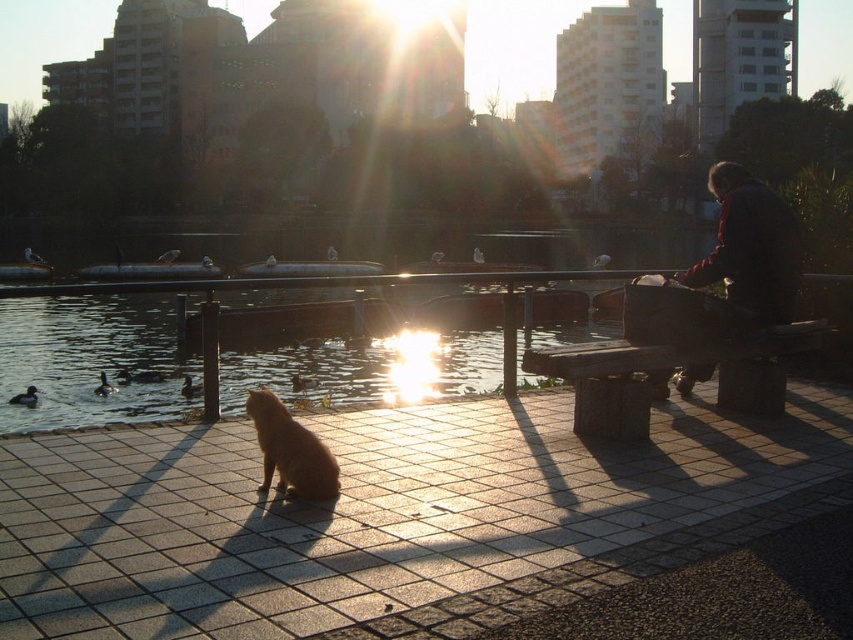
Consider the image. You are a person who is 1.8 meters tall. You want to walk from the smooth stone dock at center to the wooden bench at right. Can you walk straight without bending down? Explain your reasoning.

The smooth stone dock at center and wooden bench at right are 2.29 meters apart. Since the distance between them is greater than your height of 1.8 meters, you can walk straight without bending down as there is enough space.

You are a photographer wanting to capture the golden fur cat at center and the clear water at bench right in the same frame. Based on their positions, can you determine which object is higher in the image?

The clear water at bench right is located above the golden fur cat at center, so in the image, the clear water at bench right is higher than the golden fur cat at center.